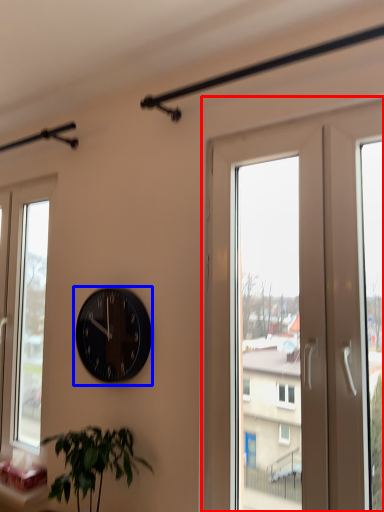
Question: Which of the following is the farthest to the observer, screen door (highlighted by a red box) or wall clock (highlighted by a blue box)?

Choices:
 (A) screen door
 (B) wall clock

Answer: (B)